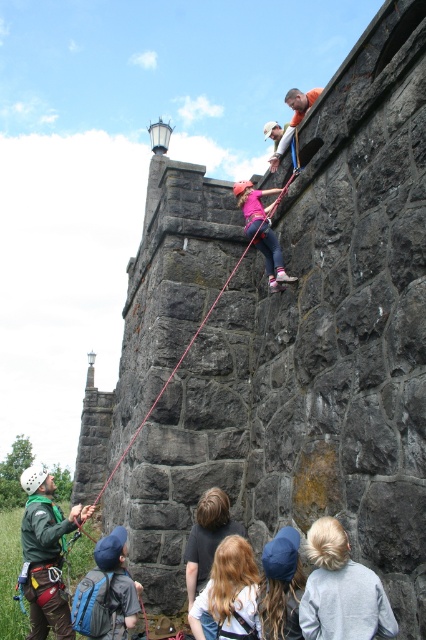
You are a photographer standing at the base of the stone wall. You want to take a closeup shot of the pink fabric climbing harness at center. Given that your camera has a maximum zoom range of 30 meters, can you capture the harness clearly?

The pink fabric climbing harness at center is 35.46 meters away from the camera. Since the camera can only zoom up to 30 meters, it cannot capture the harness clearly at this distance.

You are a climber who has just reached the top of the stone wall. You need to secure your position using the green fabric harness at lower left and the red nylon rope at center. Which item is closer to you from your current viewpoint?

The green fabric harness at lower left is in front of the red nylon rope at center, so it is closer to you from your current viewpoint.

You are standing at the point marked as point (54,621) and want to take a photo of the historic stone wall. Since you are 111.19 feet away from the viewer, can you fit the entire wall into your camera frame?

The point (54,621) is 111.19 feet away from the viewer. Since the camera frame can typically capture a wide enough angle, the entire historic stone wall should be visible in the photo.